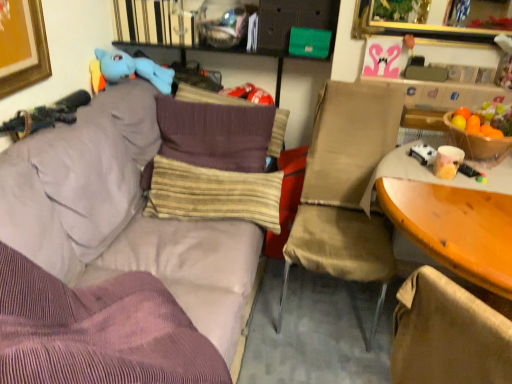
Question: Is purple corduroy couch at upper left completely or partially inside striped fabric pillow at center, the first pillow from the bottom?

Choices:
 (A) yes
 (B) no

Answer: (B)

Question: From the image's perspective, is striped fabric pillow at center, the first pillow from the bottom, over purple corduroy couch at upper left?

Choices:
 (A) no
 (B) yes

Answer: (B)

Question: From a real-world perspective, does striped fabric pillow at center, positioned as the second pillow in top-to-bottom order, sit lower than purple corduroy couch at upper left?

Choices:
 (A) yes
 (B) no

Answer: (B)

Question: Could you tell me if striped fabric pillow at center, positioned as the second pillow in top-to-bottom order, is turned towards purple corduroy couch at upper left?

Choices:
 (A) yes
 (B) no

Answer: (A)

Question: Considering the relative sizes of striped fabric pillow at center, which is the 1th pillow in front-to-back order, and purple corduroy couch at upper left in the image provided, is striped fabric pillow at center, which is the 1th pillow in front-to-back order, thinner than purple corduroy couch at upper left?

Choices:
 (A) no
 (B) yes

Answer: (B)

Question: Does point (159, 162) appear closer or farther from the camera than point (155, 72)?

Choices:
 (A) closer
 (B) farther

Answer: (A)

Question: From a real-world perspective, is striped fabric pillow at center, which is the 1th pillow in front-to-back order, positioned above or below blue plush toy at upper left?

Choices:
 (A) above
 (B) below

Answer: (B)

Question: Is striped fabric pillow at center, which is the 1th pillow in front-to-back order, spatially inside blue plush toy at upper left, or outside of it?

Choices:
 (A) inside
 (B) outside

Answer: (B)

Question: From the image's perspective, is striped fabric pillow at center, which is the 1th pillow in front-to-back order, located above or below blue plush toy at upper left?

Choices:
 (A) above
 (B) below

Answer: (B)

Question: In terms of width, does blue plush toy at upper left look wider or thinner when compared to striped fabric pillow at center, which is the 1th pillow in front-to-back order?

Choices:
 (A) thin
 (B) wide

Answer: (B)

Question: From a real-world perspective, is blue plush toy at upper left physically located above or below striped fabric pillow at center, which is the 1th pillow in front-to-back order?

Choices:
 (A) below
 (B) above

Answer: (B)

Question: In the image, is blue plush toy at upper left on the left side or the right side of striped fabric pillow at center, acting as the 2th pillow starting from the back?

Choices:
 (A) left
 (B) right

Answer: (A)

Question: Choose the correct answer: Is blue plush toy at upper left inside striped fabric pillow at center, acting as the 2th pillow starting from the back, or outside it?

Choices:
 (A) inside
 (B) outside

Answer: (B)

Question: Considering the positions of point (244, 203) and point (480, 249), is point (244, 203) closer or farther from the camera than point (480, 249)?

Choices:
 (A) closer
 (B) farther

Answer: (B)

Question: Considering the relative positions of striped fabric pillow at center, the first pillow from the bottom, and wooden table at right in the image provided, is striped fabric pillow at center, the first pillow from the bottom, to the left or to the right of wooden table at right?

Choices:
 (A) left
 (B) right

Answer: (A)